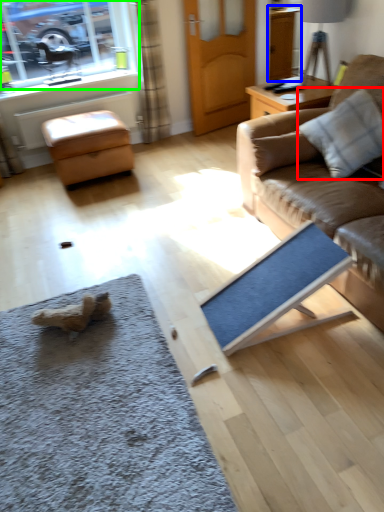
Question: Estimate the real-world distances between objects in this image. Which object is farther from pillow (highlighted by a red box), cabinetry (highlighted by a blue box) or window (highlighted by a green box)?

Choices:
 (A) cabinetry
 (B) window

Answer: (B)